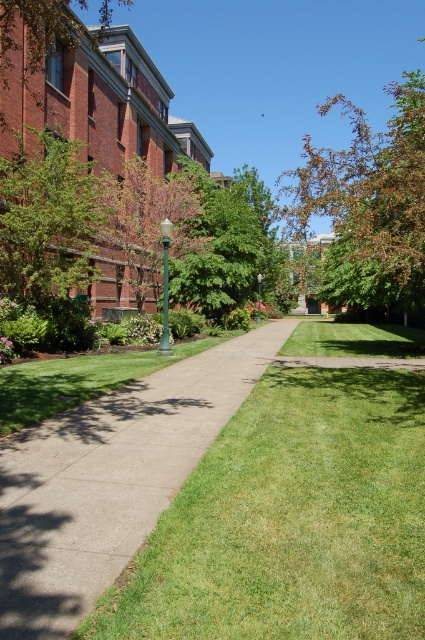
You are a maintenance worker needing to replace the green glass lamp post at center. Given that the concrete sidewalk at center is in the way, can you estimate whether the lamp post can be removed without damaging the sidewalk?

The concrete sidewalk at center is larger in size than the green glass lamp post at center, so it is likely that the lamp post can be removed without damaging the sidewalk since it is smaller in size and may be positioned adjacent to it.

You are a maintenance worker checking the green leafy tree at center and the green glass lamp post at center. Which object is taller?

The green leafy tree at center is taller than the green glass lamp post at center.

You are a maintenance worker needing to reach both the green leafy tree at center and the green glass lamp post at center. Which object is closer to you, and therefore easier to reach first without moving your position?

The green leafy tree at center is closer to you, so it is easier to reach first without moving your position because it is further to the viewer than the green glass lamp post at center.